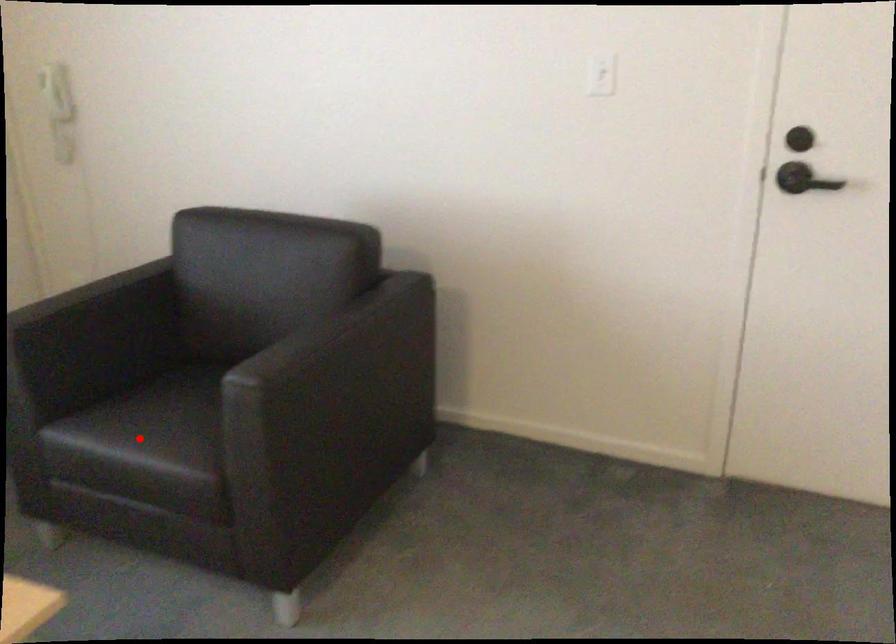
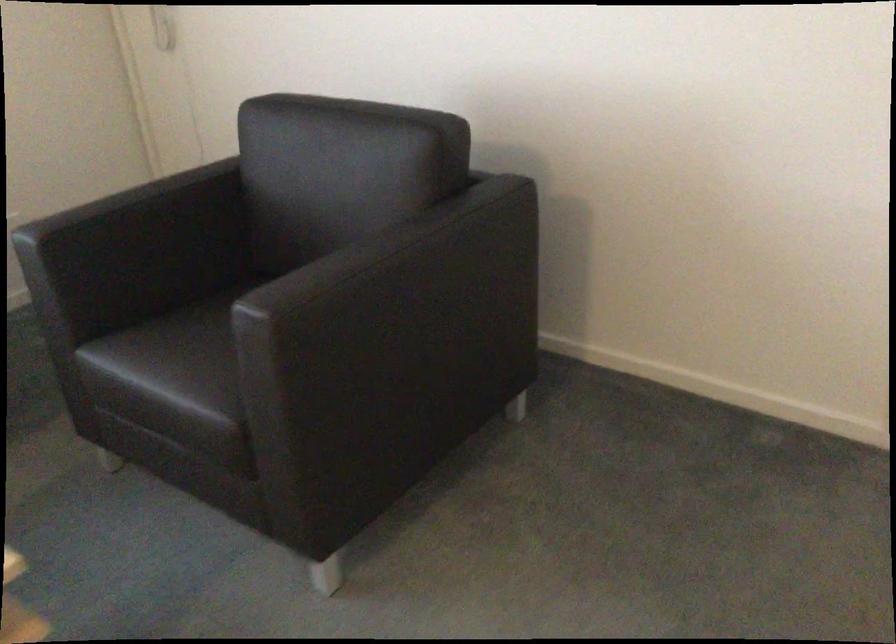
Question: I am providing you with two images of the same scene from different viewpoints. A red point is shown in image1. For the corresponding object point in image2, is it positioned nearer or farther from the camera?

Choices:
 (A) Nearer
 (B) Farther

Answer: (A)